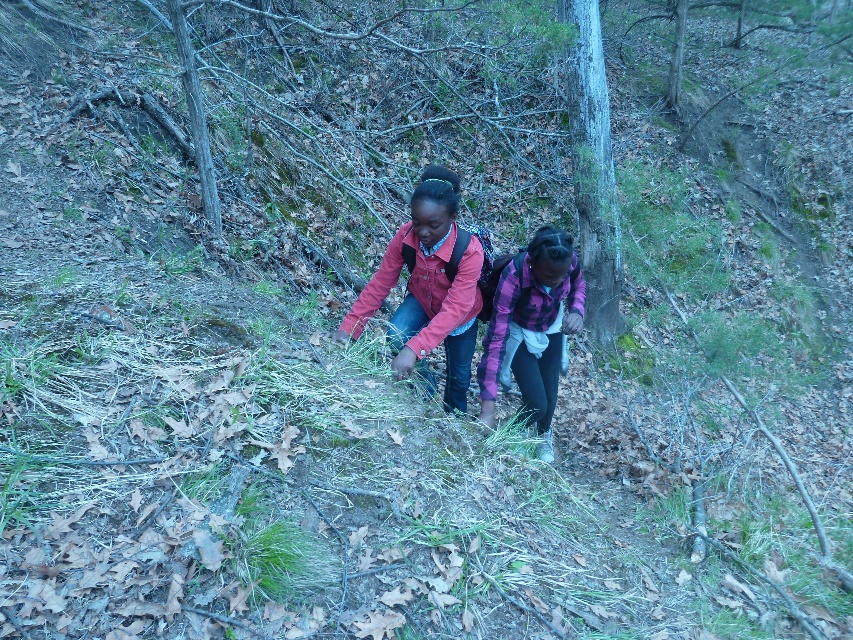
Which is behind, point (410, 276) or point (538, 432)?

Positioned behind is point (538, 432).

Is point (438, 276) closer to viewer compared to point (561, 346)?

Yes, it is in front of point (561, 346).

The width and height of the screenshot is (853, 640). In order to click on matte pink jacket at center in this screenshot , I will do click(428, 285).

In the scene shown: Who is taller, purple fleece jacket at center or smooth gray bark at center?

Standing taller between the two is smooth gray bark at center.

Between point (550, 419) and point (560, 8), which one is positioned in front?

Point (550, 419) is in front.

The width and height of the screenshot is (853, 640). What are the coordinates of `purple fleece jacket at center` in the screenshot? It's located at (532, 326).

Can you confirm if matte pink jacket at center is positioned above smooth gray bark at center?

Actually, matte pink jacket at center is below smooth gray bark at center.

Is point (442, 310) positioned behind point (583, 236)?

That is False.

Is point (399, 253) positioned behind point (575, 70)?

No, it is not.

This screenshot has width=853, height=640. Identify the location of matte pink jacket at center. (428, 285).